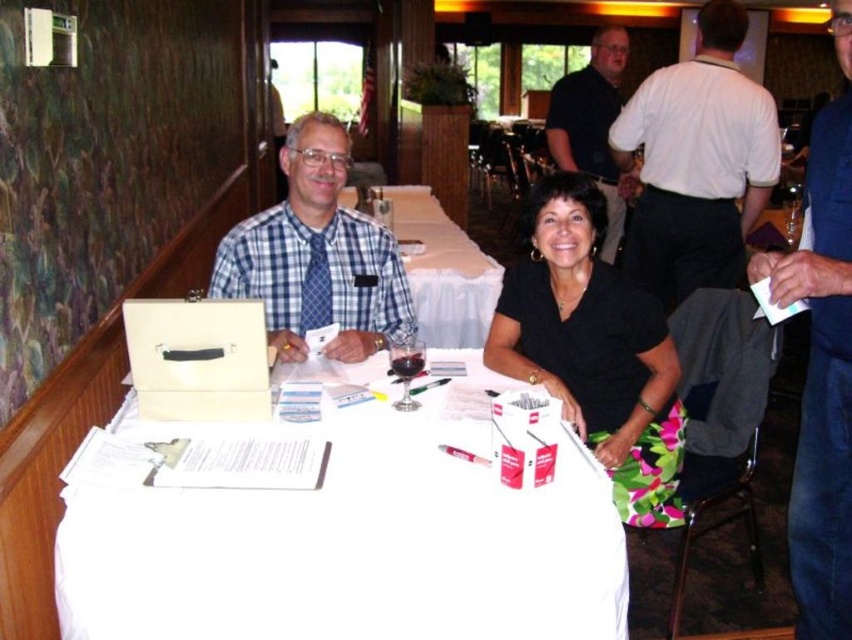
From the picture: You are an event planner observing the scene. You need to determine the correct order of the blue shirt at center and the blue checkered shirt at center from top to bottom. Which one is on top?

The blue checkered shirt at center is on top because the blue shirt at center is positioned under it.

In the scene shown: You are a photographer at the event and need to ensure all attendees are visible in the group photo. Given that the blue shirt at center and the blue checkered shirt at center are both in the frame, which one is more likely to be noticed due to its size?

The blue shirt at center is more likely to be noticed because it has a larger size compared to the blue checkered shirt at center.